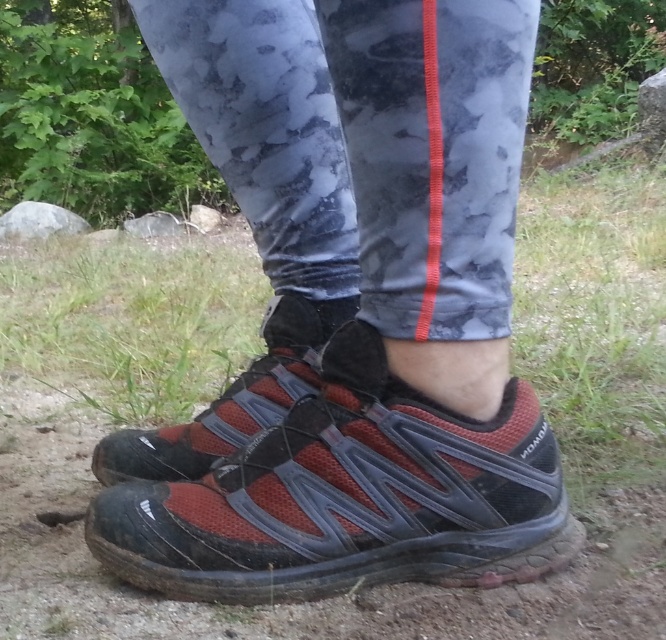
Which is behind, point (376, 449) or point (282, 404)?

Point (282, 404)

Can you confirm if red mesh shoe at lower center is bigger than red mesh shoe at center?

Yes, red mesh shoe at lower center is bigger than red mesh shoe at center.

Between point (440, 458) and point (135, 451), which one is positioned behind?

The point (135, 451) is more distant.

What are the coordinates of `red mesh shoe at lower center` in the screenshot? It's located at (350, 497).

Who is more forward, [418,148] or [204,426]?

Point [418,148]

Does matte red mesh shoe at center have a greater width compared to red mesh shoe at center?

Yes, matte red mesh shoe at center is wider than red mesh shoe at center.

Does point (276, 506) lie behind point (266, 349)?

No.

The height and width of the screenshot is (640, 666). I want to click on matte red mesh shoe at center, so click(354, 310).

Between matte red mesh shoe at center and red mesh shoe at lower center, which one has more height?

Standing taller between the two is matte red mesh shoe at center.

This screenshot has height=640, width=666. I want to click on matte red mesh shoe at center, so click(x=354, y=310).